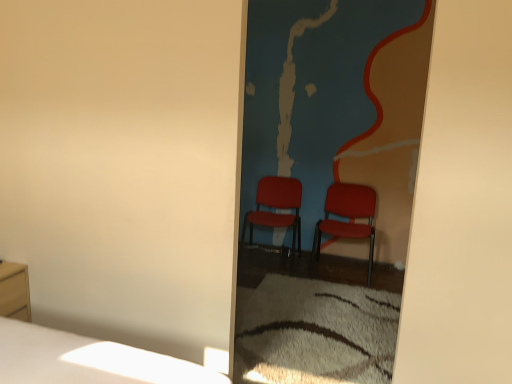
Question: Is matte red chair at center, the 1th chair from the left, oriented towards matte plastic chair at center, acting as the 1th chair starting from the right?

Choices:
 (A) yes
 (B) no

Answer: (B)

Question: Does matte red chair at center, the 1th chair from the left, have a greater width compared to matte plastic chair at center, acting as the 1th chair starting from the right?

Choices:
 (A) yes
 (B) no

Answer: (A)

Question: Does matte red chair at center, the 1th chair from the left, have a lesser width compared to matte plastic chair at center, which is the second chair from left to right?

Choices:
 (A) yes
 (B) no

Answer: (B)

Question: Is matte red chair at center, the second chair from the right, not close to matte plastic chair at center, acting as the 1th chair starting from the right?

Choices:
 (A) no
 (B) yes

Answer: (A)

Question: Can you confirm if matte red chair at center, the 1th chair from the left, is bigger than matte plastic chair at center, acting as the 1th chair starting from the right?

Choices:
 (A) no
 (B) yes

Answer: (B)

Question: Considering the relative positions of matte red chair at center, the 1th chair from the left, and matte plastic chair at center, which is the second chair from left to right, in the image provided, is matte red chair at center, the 1th chair from the left, to the left of matte plastic chair at center, which is the second chair from left to right, from the viewer's perspective?

Choices:
 (A) yes
 (B) no

Answer: (A)

Question: Is matte red chair at center, the 1th chair from the left, positioned beyond the bounds of matte red chairs at center?

Choices:
 (A) no
 (B) yes

Answer: (B)

Question: Is matte red chairs at center completely or partially inside matte red chair at center, the second chair from the right?

Choices:
 (A) no
 (B) yes

Answer: (A)

Question: Is matte red chair at center, the 1th chair from the left, oriented away from matte red chairs at center?

Choices:
 (A) yes
 (B) no

Answer: (B)

Question: From the image's perspective, is matte red chair at center, the 1th chair from the left, over matte red chairs at center?

Choices:
 (A) yes
 (B) no

Answer: (B)

Question: Is matte red chair at center, the 1th chair from the left, smaller than matte red chairs at center?

Choices:
 (A) no
 (B) yes

Answer: (A)

Question: From the image's perspective, would you say matte red chair at center, the 1th chair from the left, is shown under matte red chairs at center?

Choices:
 (A) yes
 (B) no

Answer: (A)

Question: Is matte red chairs at center positioned with its back to matte wood nightstand at lower left?

Choices:
 (A) no
 (B) yes

Answer: (A)